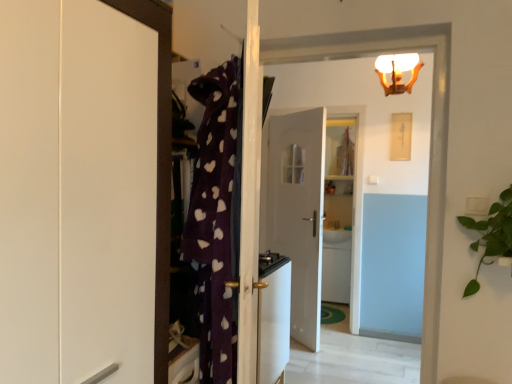
Question: Looking at the image, does white glossy door at center, acting as the second door starting from the front, seem bigger or smaller compared to white frosted glass light fixture at upper center?

Choices:
 (A) small
 (B) big

Answer: (B)

Question: From their relative heights in the image, would you say white glossy door at center, acting as the second door starting from the front, is taller or shorter than white frosted glass light fixture at upper center?

Choices:
 (A) short
 (B) tall

Answer: (B)

Question: Considering the real-world distances, which object is closest to the white glossy door at center, arranged as the 1th door when viewed from the back?

Choices:
 (A) green leafy plant at right
 (B) white glossy cabinet at left
 (C) white glossy sink at center
 (D) white frosted glass light fixture at upper center
 (E) white glossy stove at center

Answer: (C)

Question: Which is farther from the white glossy stove at center?

Choices:
 (A) white glossy sink at center
 (B) white frosted glass light fixture at upper center
 (C) white glossy door at center, acting as the second door starting from the front
 (D) white glossy door at upper center, acting as the first door starting from the front
 (E) green leafy plant at right

Answer: (A)